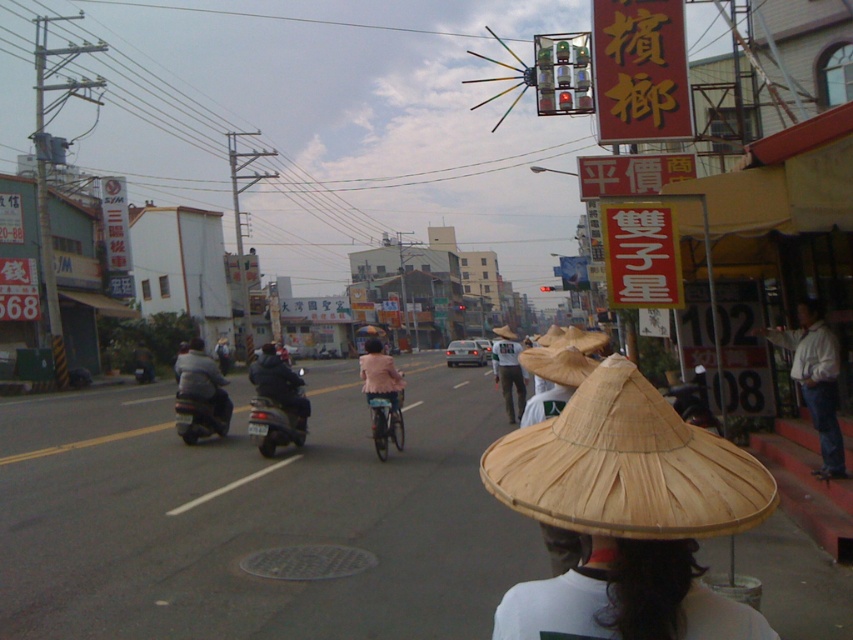
Can you confirm if brown woven straw hat at center is positioned to the left of dark gray leather jacket at center-left?

Incorrect, brown woven straw hat at center is not on the left side of dark gray leather jacket at center-left.

Is brown woven straw hat at center wider than dark gray leather jacket at center-left?

Yes, brown woven straw hat at center is wider than dark gray leather jacket at center-left.

Measure the distance between brown woven straw hat at center and camera.

brown woven straw hat at center is 14.18 feet from camera.

The height and width of the screenshot is (640, 853). I want to click on brown woven straw hat at center, so click(564, 356).

Which is more to the left, white cotton shirt at center or metallic silver motorcycle at center?

From the viewer's perspective, metallic silver motorcycle at center appears more on the left side.

Between white cotton shirt at center and metallic silver motorcycle at center, which one is positioned higher?

Positioned higher is white cotton shirt at center.

Which is in front, point (511, 376) or point (390, 410)?

Point (390, 410) is more forward.

The image size is (853, 640). Find the location of `white cotton shirt at center`. white cotton shirt at center is located at coordinates (508, 371).

Looking at this image, can you confirm if dark blue leather jacket at center is positioned above white cotton shirt at center?

No, dark blue leather jacket at center is not above white cotton shirt at center.

Does dark blue leather jacket at center appear under white cotton shirt at center?

Indeed, dark blue leather jacket at center is positioned under white cotton shirt at center.

Describe the element at coordinates (279, 385) in the screenshot. I see `dark blue leather jacket at center` at that location.

Find the location of a particular element. Image resolution: width=853 pixels, height=640 pixels. dark blue leather jacket at center is located at coordinates (279, 385).